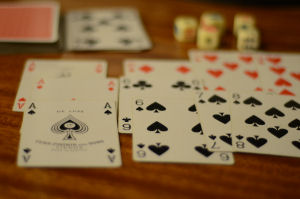
Locate an element on the screen. The height and width of the screenshot is (199, 300). card game dice is located at coordinates (187, 31), (207, 37), (214, 23), (240, 21), (247, 38).